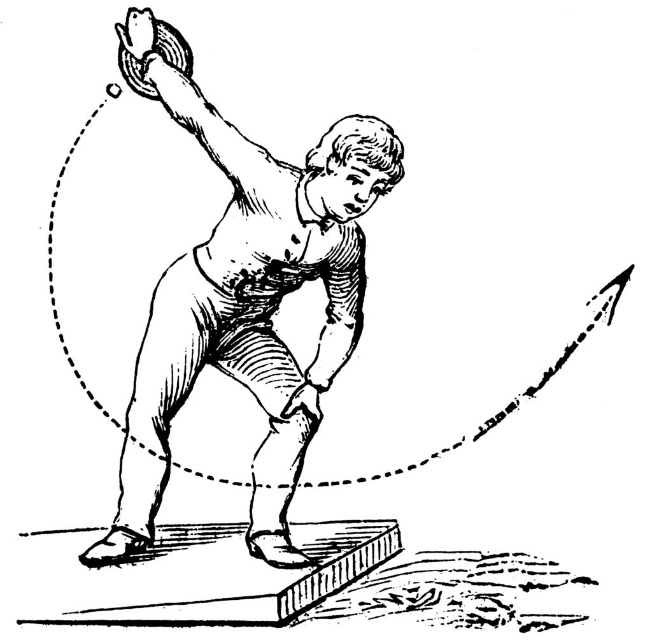
You are a judge at a hammer throw event. You need to determine if the black line at upper center is taller than the smooth paper man at center. Based on the image, what is your conclusion?

The black line at upper center is not as tall as smooth paper man at center, so the judge should conclude that the black line at upper center is shorter than the smooth paper man at center.

You are a coach observing a hammer throw athlete. You notice the black line at upper center and the smooth paper man at center in the image. Which object is positioned lower in the scene?

The black line at upper center is located below the smooth paper man at center, so the black line at upper center is positioned lower in the scene.